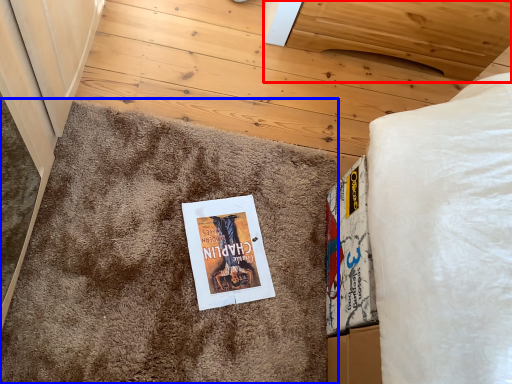
Question: Which object is further to the camera taking this photo, furniture (highlighted by a red box) or doormat (highlighted by a blue box)?

Choices:
 (A) furniture
 (B) doormat

Answer: (A)